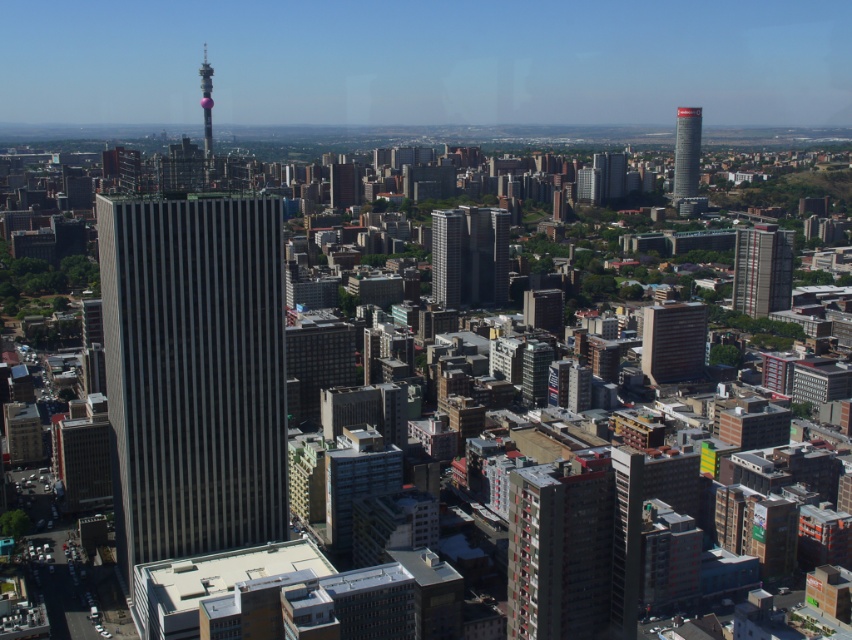
Question: Is smooth glass skyscraper at center smaller than metallic glass tower at center?

Choices:
 (A) no
 (B) yes

Answer: (A)

Question: Does red brick building at center come behind gray concrete building at center-right?

Choices:
 (A) no
 (B) yes

Answer: (A)

Question: Among these points, which one is nearest to the camera?

Choices:
 (A) (441, 272)
 (B) (734, 288)
 (C) (482, 257)

Answer: (A)

Question: Among these points, which one is farthest from the camera?

Choices:
 (A) (757, 291)
 (B) (453, 216)
 (C) (543, 483)
 (D) (680, 115)

Answer: (A)

Question: In this image, where is dark gray glass skyscraper at center located relative to gray concrete building at center-right?

Choices:
 (A) below
 (B) above

Answer: (A)

Question: Which of the following is the closest to the observer?

Choices:
 (A) smooth glass skyscraper at center
 (B) dark gray glass skyscraper at center

Answer: (B)